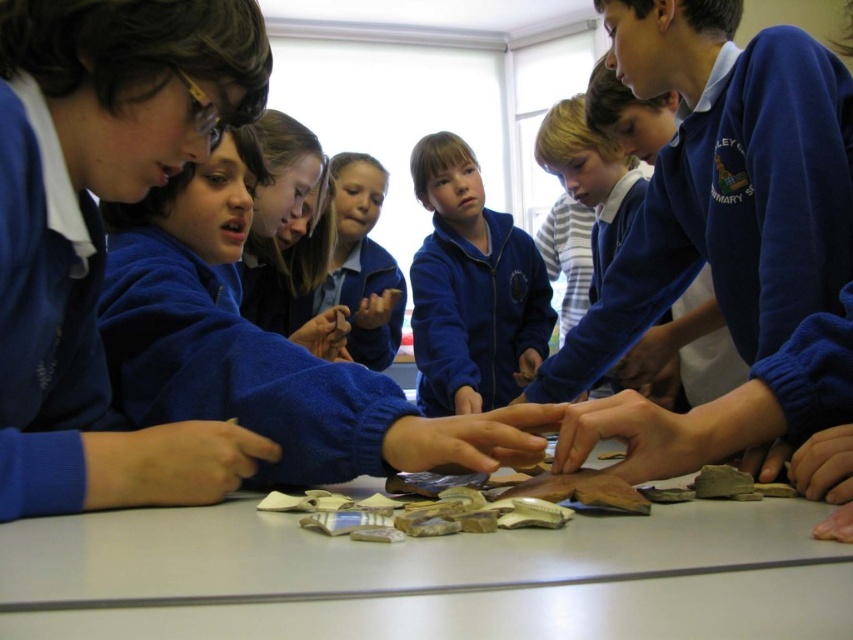
Question: Which object appears closest to the camera in this image?

Choices:
 (A) matte blue jacket at center
 (B) matte blue uniform at center

Answer: (A)

Question: Which of these objects is positioned closest to the blue uniform shirt at upper right?

Choices:
 (A) matte blue jacket at center
 (B) matte blue uniform at center

Answer: (A)

Question: Is matte blue jacket at center above blue uniform shirt at upper right?

Choices:
 (A) no
 (B) yes

Answer: (A)

Question: Based on their relative distances, which object is nearer to the matte blue uniform at center?

Choices:
 (A) blue uniform shirt at upper right
 (B) matte blue jacket at center

Answer: (B)

Question: Can you confirm if matte blue jacket at center is positioned above matte blue uniform at center?

Choices:
 (A) yes
 (B) no

Answer: (B)

Question: Is matte blue jacket at center smaller than blue uniform shirt at upper right?

Choices:
 (A) yes
 (B) no

Answer: (A)